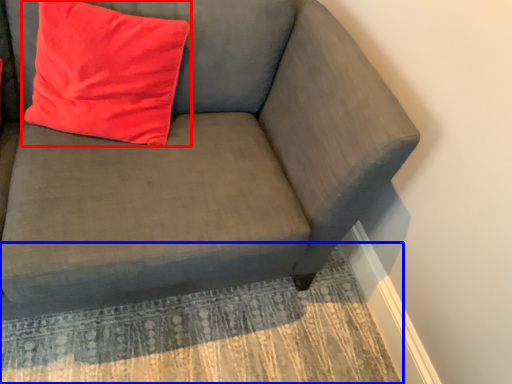
Question: Which of the following is the closest to the observer, pillow (highlighted by a red box) or mat (highlighted by a blue box)?

Choices:
 (A) pillow
 (B) mat

Answer: (A)